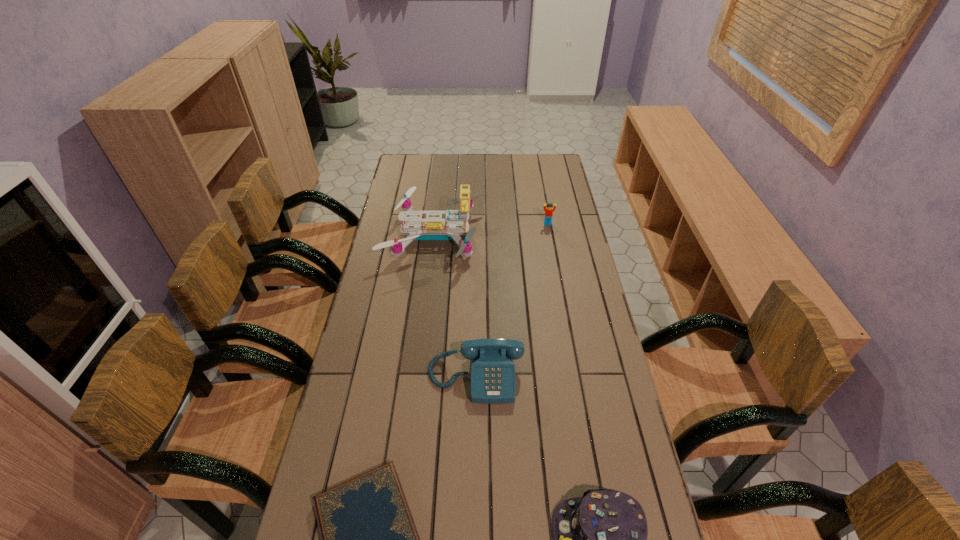
At what (x,y) coordinates should I click in order to perform the action: click on free space that satisfies the following two spatial constraints: 1. on the face of the Lego; 2. on the front-facing side of the tallest object. Please return your answer as a coordinate pair (x, y). The height and width of the screenshot is (540, 960). Looking at the image, I should click on (550, 236).